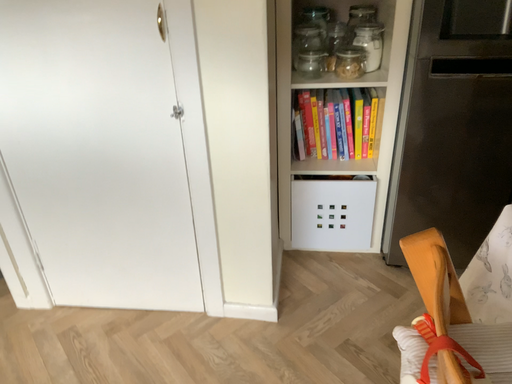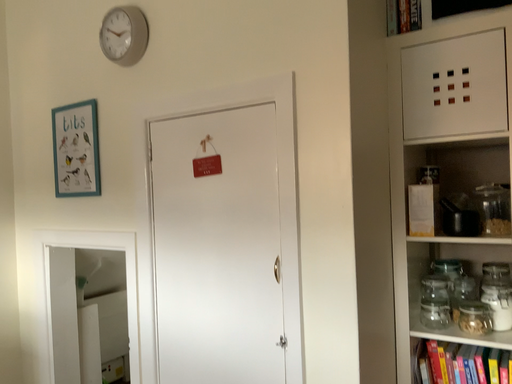
Question: Which way did the camera rotate in the video?

Choices:
 (A) rotated downward
 (B) rotated upward

Answer: (B)